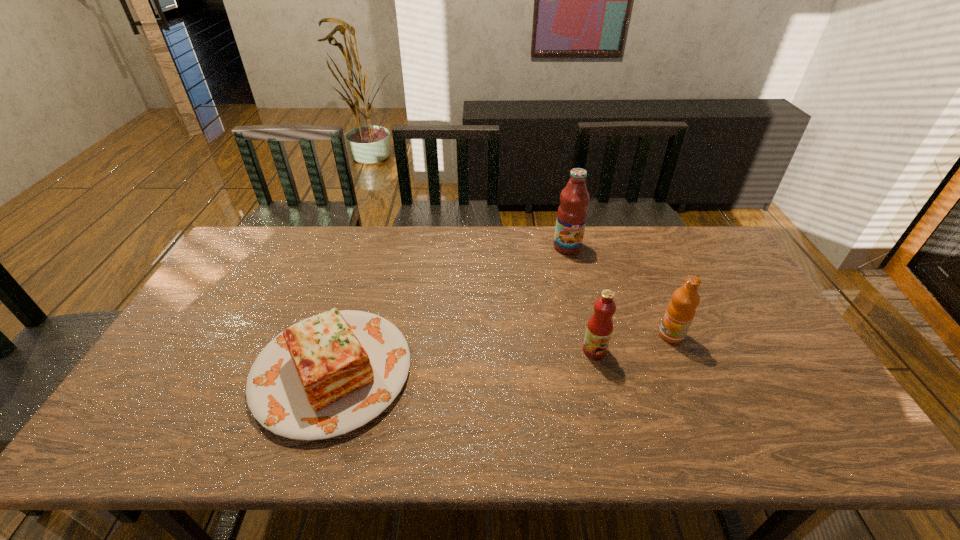
Where is `free space between the leftmost object and the rightmost fruit juice`? free space between the leftmost object and the rightmost fruit juice is located at coordinates click(502, 353).

Choose which object is the third nearest neighbor to the shortest object. Please provide its 2D coordinates. Your answer should be formatted as a tuple, i.e. [(x, y)], where the tuple contains the x and y coordinates of a point satisfying the conditions above.

[(681, 310)]

Find the location of a particular element. This screenshot has width=960, height=540. object identified as the closest to the rightmost fruit juice is located at coordinates (599, 329).

Identify the location of the closest fruit juice to the leftmost object. The image size is (960, 540). (599, 329).

Find the location of a particular element. fruit juice object that ranks as the third closest to the shortest object is located at coordinates (681, 310).